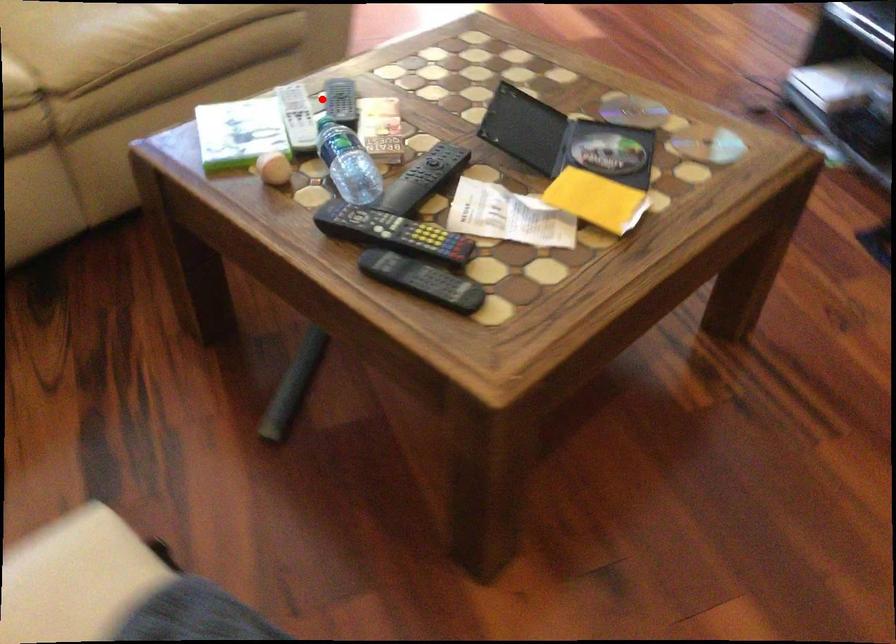
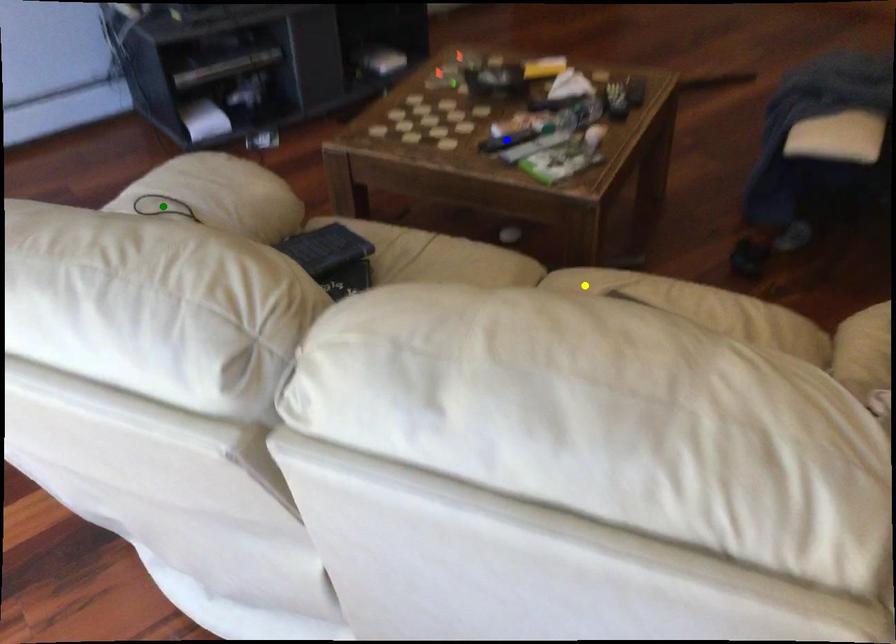
Question: I am providing you with two images of the same scene from different viewpoints. A red point is marked on the first image. You are given multiple points on the second image. In image 2, which mark is for the same physical point as the one in image 1?

Choices:
 (A) blue point
 (B) green point
 (C) yellow point

Answer: (A)